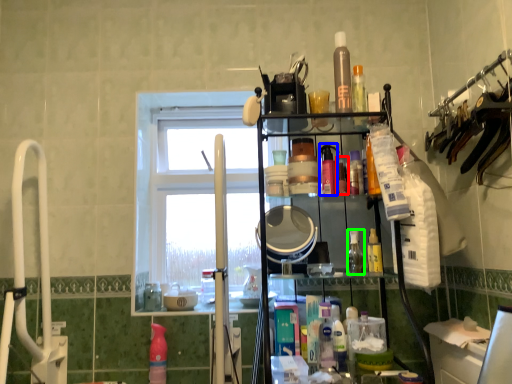
Question: Which object is the closest to the toiletry (highlighted by a red box)? Choose among these: toiletry (highlighted by a blue box) or toiletry (highlighted by a green box).

Choices:
 (A) toiletry
 (B) toiletry

Answer: (A)